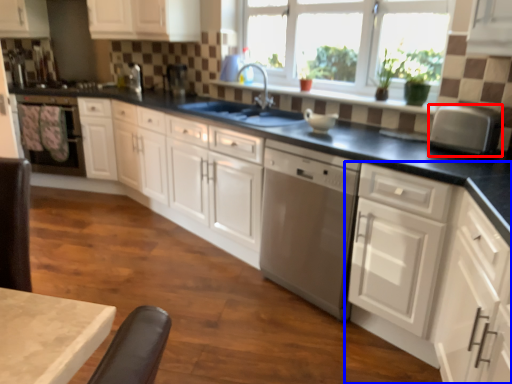
Question: Which of the following is the farthest to the observer, kitchen appliance (highlighted by a red box) or cabinetry (highlighted by a blue box)?

Choices:
 (A) kitchen appliance
 (B) cabinetry

Answer: (A)